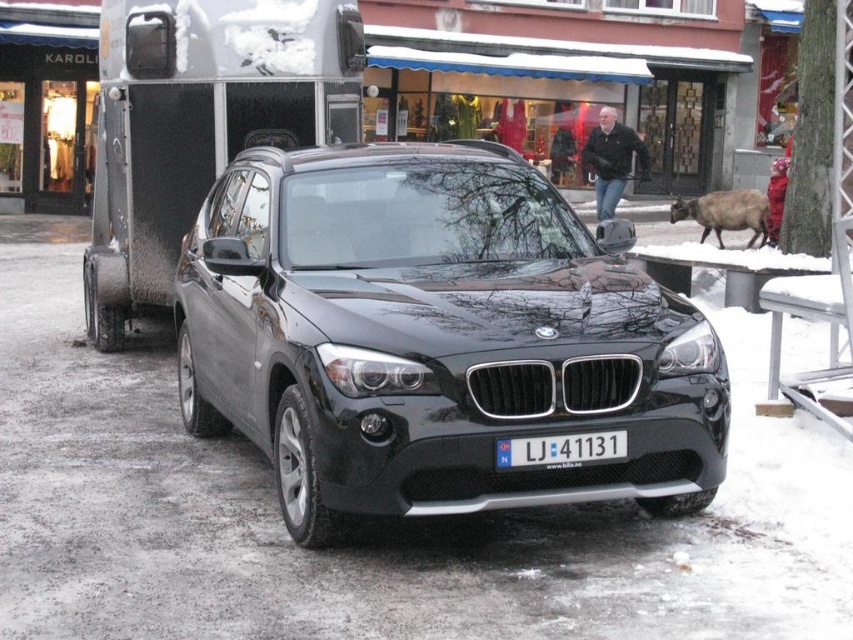
Measure the distance between glossy black suv at center and camera.

glossy black suv at center is 4.13 meters from camera.

Between glossy black suv at center and metallic silver trailer at left, which one is positioned higher?

metallic silver trailer at left

Locate an element on the screen. glossy black suv at center is located at coordinates (434, 339).

You are a GUI agent. You are given a task and a screenshot of the screen. Output one action in this format:
    pyautogui.click(x=<x>, y=<y>)
    Task: Click on the glossy black suv at center
    The width and height of the screenshot is (853, 640).
    Given the screenshot: What is the action you would take?
    pyautogui.click(x=434, y=339)

Looking at this image, how far apart are glossy black suv at center and brown furry goat at right?

A distance of 10.67 meters exists between glossy black suv at center and brown furry goat at right.

Describe the element at coordinates (434, 339) in the screenshot. Image resolution: width=853 pixels, height=640 pixels. I see `glossy black suv at center` at that location.

Is point (607, 465) positioned before point (698, 208)?

Yes, it is in front of point (698, 208).

Locate an element on the screen. glossy black suv at center is located at coordinates (434, 339).

Does point (537, 456) lie behind point (717, 214)?

No.

The height and width of the screenshot is (640, 853). Identify the location of white plastic license plate at center. (561, 449).